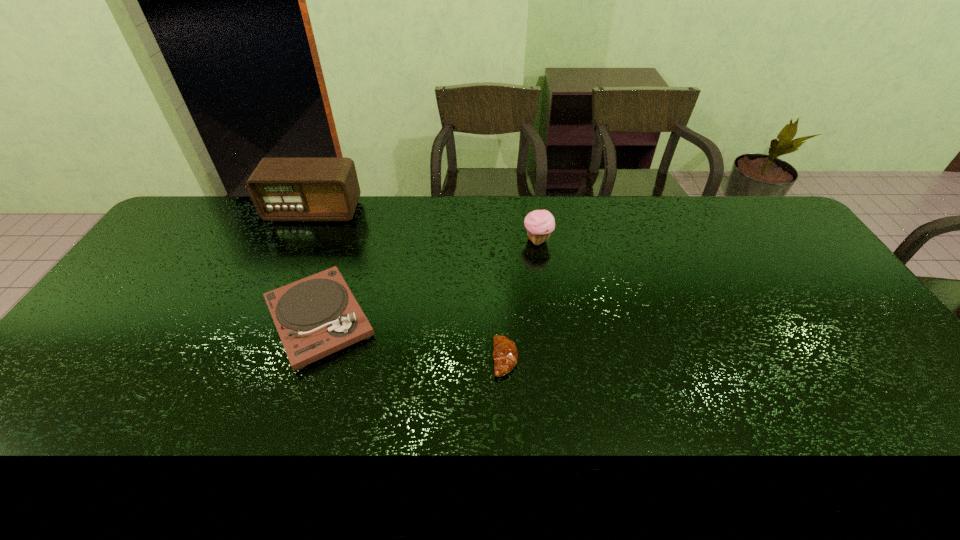
Locate an element on the screen. This screenshot has width=960, height=540. free space between the farthest object and the cupcake is located at coordinates (x=425, y=226).

Where is `blank region between the crescent roll and the tallest object`? The width and height of the screenshot is (960, 540). blank region between the crescent roll and the tallest object is located at coordinates (409, 285).

This screenshot has width=960, height=540. Find the location of `unoccupied position between the phonograph_record and the farthest object`. unoccupied position between the phonograph_record and the farthest object is located at coordinates (317, 265).

This screenshot has width=960, height=540. In order to click on blank region between the crescent roll and the third tallest object in this screenshot , I will do `click(412, 339)`.

Identify the location of free space that is in between the radio receiver and the shortest object. This screenshot has width=960, height=540. (409, 285).

The width and height of the screenshot is (960, 540). In order to click on vacant area between the radio receiver and the phonograph_record in this screenshot , I will do `click(317, 265)`.

At what (x,y) coordinates should I click in order to perform the action: click on unoccupied position between the second shortest object and the shortest object. Please return your answer as a coordinate pair (x, y). Looking at the image, I should click on (412, 339).

Locate an element on the screen. The width and height of the screenshot is (960, 540). free spot between the shortest object and the second shortest object is located at coordinates (412, 339).

This screenshot has height=540, width=960. I want to click on object that stands as the second closest to the tallest object, so click(540, 223).

The width and height of the screenshot is (960, 540). What are the coordinates of `object that is the second nearest to the shortest object` in the screenshot? It's located at (540, 223).